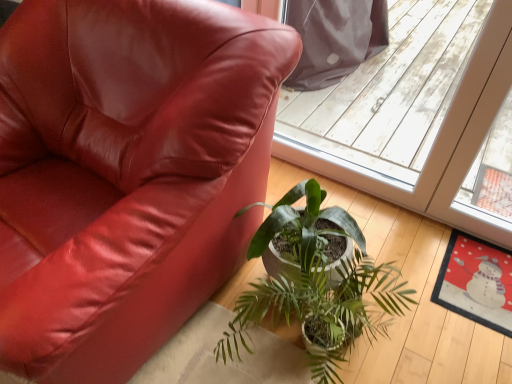
Question: Considering the relative sizes of green glossy plant at center and matte leather chair at lower left in the image provided, is green glossy plant at center taller than matte leather chair at lower left?

Choices:
 (A) no
 (B) yes

Answer: (A)

Question: From a real-world perspective, is green glossy plant at center over matte leather chair at lower left?

Choices:
 (A) yes
 (B) no

Answer: (B)

Question: Considering the relative positions of green glossy plant at center and matte leather chair at lower left in the image provided, is green glossy plant at center behind matte leather chair at lower left?

Choices:
 (A) yes
 (B) no

Answer: (A)

Question: From the image's perspective, is green glossy plant at center under matte leather chair at lower left?

Choices:
 (A) yes
 (B) no

Answer: (A)

Question: From the image's perspective, is green glossy plant at center on top of matte leather chair at lower left?

Choices:
 (A) no
 (B) yes

Answer: (A)

Question: Does point (246, 49) appear closer or farther from the camera than point (370, 263)?

Choices:
 (A) farther
 (B) closer

Answer: (B)

Question: From the image's perspective, is matte leather chair at lower left above or below green glossy plant at center?

Choices:
 (A) below
 (B) above

Answer: (B)

Question: From a real-world perspective, is matte leather chair at lower left physically located above or below green glossy plant at center?

Choices:
 (A) above
 (B) below

Answer: (A)

Question: Choose the correct answer: Is matte leather chair at lower left inside green glossy plant at center or outside it?

Choices:
 (A) inside
 (B) outside

Answer: (B)

Question: From the image's perspective, is transparent plastic screen door at upper center located above or below green glossy plant at center?

Choices:
 (A) above
 (B) below

Answer: (A)

Question: Is transparent plastic screen door at upper center in front of or behind green glossy plant at center in the image?

Choices:
 (A) behind
 (B) front

Answer: (A)

Question: In terms of height, does transparent plastic screen door at upper center look taller or shorter compared to green glossy plant at center?

Choices:
 (A) tall
 (B) short

Answer: (A)

Question: Does point (488, 129) appear closer or farther from the camera than point (390, 286)?

Choices:
 (A) farther
 (B) closer

Answer: (A)

Question: Is green glossy plant at center taller or shorter than matte leather chair at lower left?

Choices:
 (A) tall
 (B) short

Answer: (B)

Question: From the image's perspective, relative to matte leather chair at lower left, is green glossy plant at center above or below?

Choices:
 (A) below
 (B) above

Answer: (A)